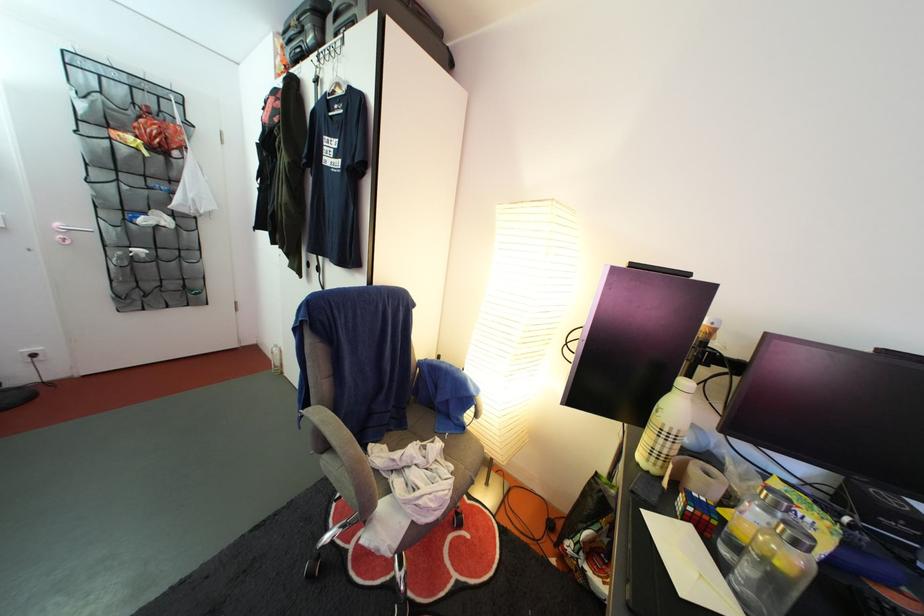
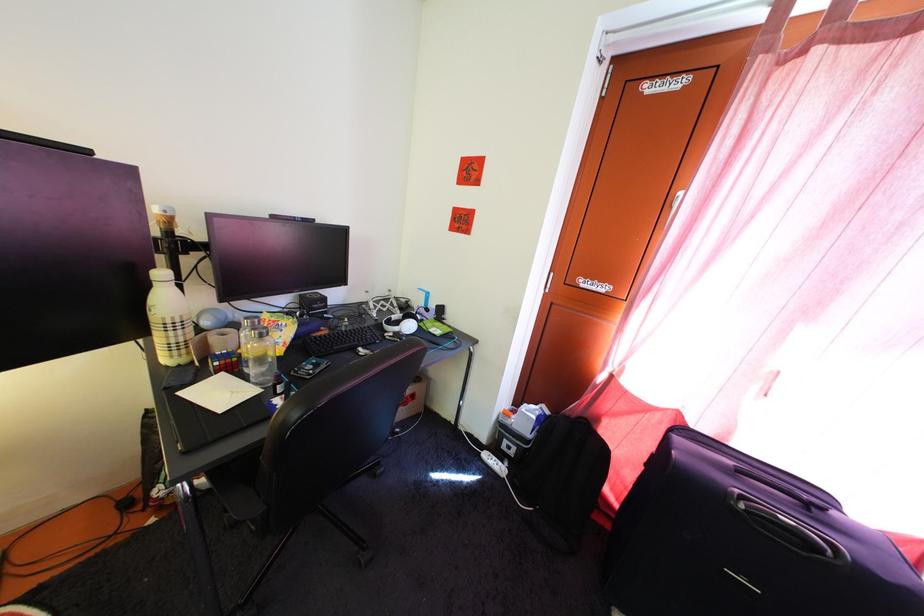
The point at (699, 517) is marked in the first image. Where is the corresponding point in the second image?

(225, 371)